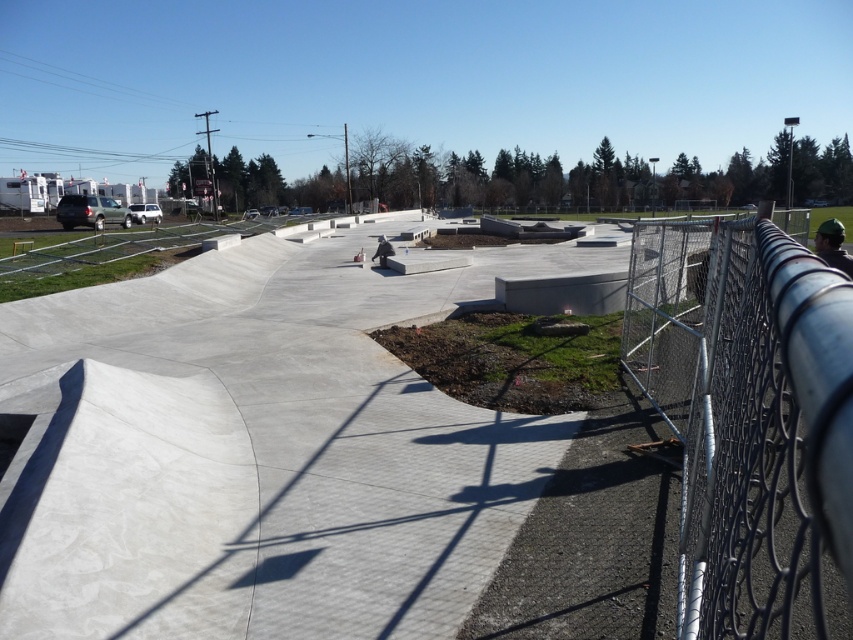
Question: Can you confirm if concrete skate park at center is thinner than silver chain-link fence at right?

Choices:
 (A) no
 (B) yes

Answer: (A)

Question: Is concrete skate park at center to the left of silver chain-link fence at right from the viewer's perspective?

Choices:
 (A) no
 (B) yes

Answer: (B)

Question: Where is concrete skate park at center located in relation to silver chain-link fence at right in the image?

Choices:
 (A) left
 (B) right

Answer: (A)

Question: Among these objects, which one is farthest from the camera?

Choices:
 (A) concrete skate park at center
 (B) silver chain-link fence at right

Answer: (B)